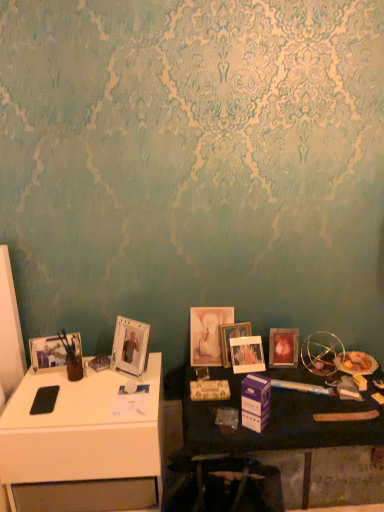
Question: Considering the positions of matte white picture frame at center, acting as the second picture frame starting from the right, and clear plastic picture frame at left, the 5th picture frame viewed from the right, in the image, is matte white picture frame at center, acting as the second picture frame starting from the right, bigger or smaller than clear plastic picture frame at left, the 5th picture frame viewed from the right,?

Choices:
 (A) big
 (B) small

Answer: (B)

Question: Relative to clear plastic picture frame at left, which appears as the second picture frame when viewed from the left, is matte white picture frame at center, the 5th picture frame positioned from the left, in front or behind?

Choices:
 (A) front
 (B) behind

Answer: (B)

Question: Which object is positioned closest to the matte glass picture frame at center right, which is the 1th picture frame in right-to-left order?

Choices:
 (A) clear plastic picture frame at left, which appears as the second picture frame when viewed from the left
 (B) matte glass picture frame at center, acting as the fourth picture frame starting from the right
 (C) matte silver picture frame at left, marked as the 6th picture frame in a right-to-left arrangement
 (D) matte glass photo frame at center, which is counted as the third picture frame, starting from the right
 (E) wooden table at lower right

Answer: (D)

Question: Which is nearer to the matte silver picture frame at left, acting as the first picture frame starting from the left?

Choices:
 (A) white glossy desk at left
 (B) matte glass picture frame at center, acting as the fourth picture frame starting from the right
 (C) wooden table at lower right
 (D) clear plastic picture frame at left, which appears as the second picture frame when viewed from the left
 (E) matte glass picture frame at center right, the 6th picture frame in the left-to-right sequence

Answer: (D)